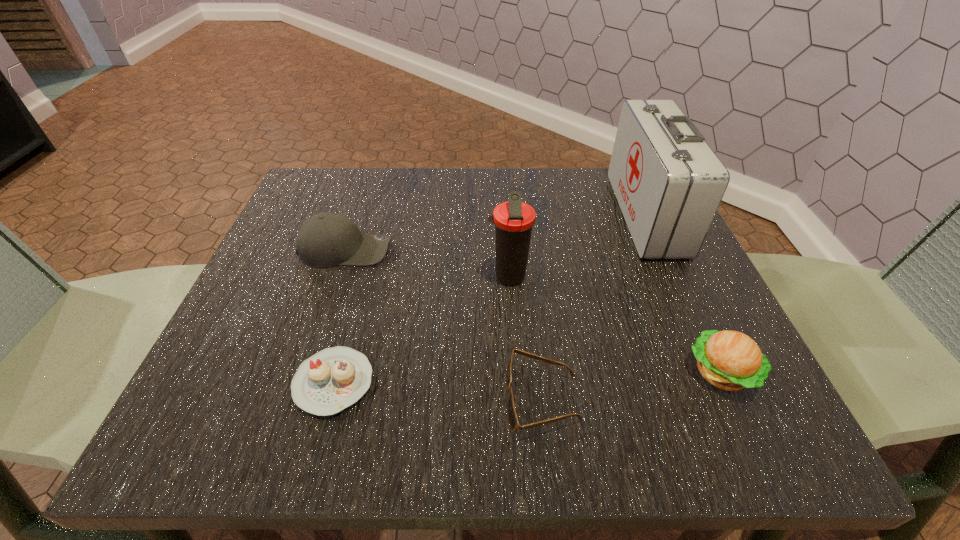
Locate an element on the screen. the first-aid kit is located at coordinates (668, 182).

Find the location of `the fifth shortest object`. the fifth shortest object is located at coordinates (513, 220).

Where is `baseball cap`? This screenshot has width=960, height=540. baseball cap is located at coordinates (327, 239).

Where is `hamburger`? The width and height of the screenshot is (960, 540). hamburger is located at coordinates (730, 360).

The image size is (960, 540). I want to click on cupcake, so click(333, 379).

This screenshot has width=960, height=540. Identify the location of sunglasses. (511, 413).

Identify the location of free space located 0.240m on the front-facing side of the first-aid kit. The width and height of the screenshot is (960, 540). (513, 214).

Locate an element on the screen. The width and height of the screenshot is (960, 540). free space located on the front-facing side of the first-aid kit is located at coordinates tap(531, 214).

Where is `free region located 0.330m on the front-facing side of the first-aid kit`? This screenshot has height=540, width=960. free region located 0.330m on the front-facing side of the first-aid kit is located at coordinates (472, 214).

Identify the location of free space located 0.130m on the back of the thermos bottle. The width and height of the screenshot is (960, 540). (505, 223).